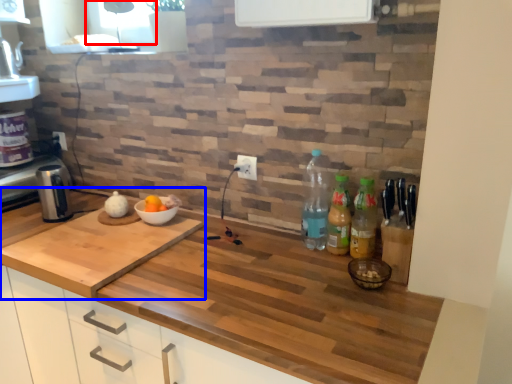
Question: Among these objects, which one is nearest to the camera, window screen (highlighted by a red box) or countertop (highlighted by a blue box)?

Choices:
 (A) window screen
 (B) countertop

Answer: (B)